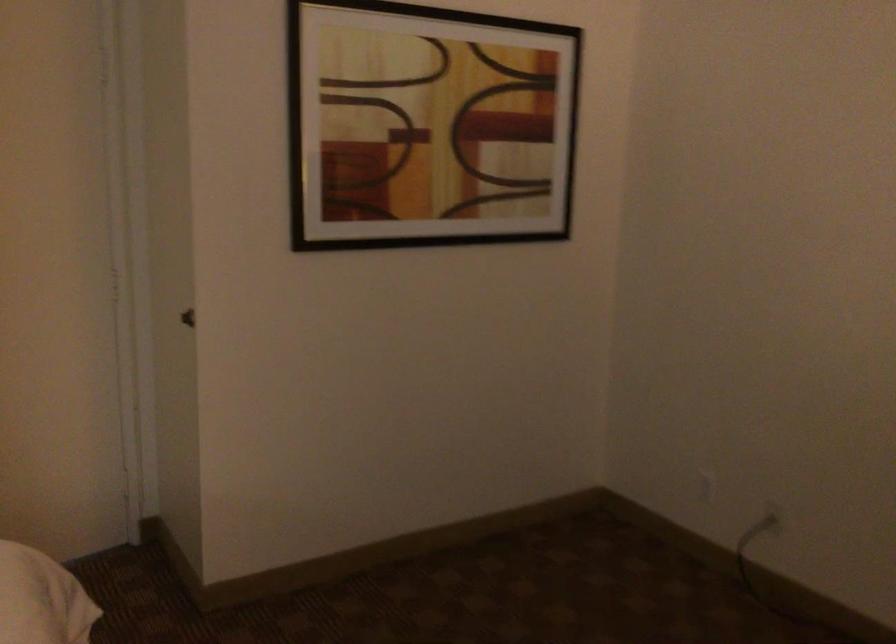
Image resolution: width=896 pixels, height=644 pixels. In order to click on power cord plug in this screenshot , I will do `click(707, 487)`.